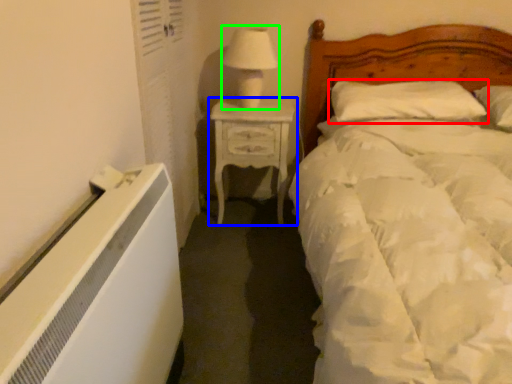
Question: Estimate the real-world distances between objects in this image. Which object is closer to pillow (highlighted by a red box), nightstand (highlighted by a blue box) or table lamp (highlighted by a green box)?

Choices:
 (A) nightstand
 (B) table lamp

Answer: (A)